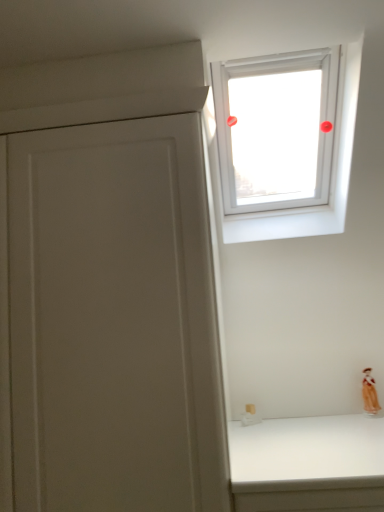
Question: Considering the positions of point (304, 52) and point (372, 385), is point (304, 52) closer or farther from the camera than point (372, 385)?

Choices:
 (A) closer
 (B) farther

Answer: (A)

Question: Which is correct: transparent glass window at upper center is inside matte orange figurine at lower right, or outside of it?

Choices:
 (A) inside
 (B) outside

Answer: (B)

Question: In terms of size, does transparent glass window at upper center appear bigger or smaller than matte orange figurine at lower right?

Choices:
 (A) big
 (B) small

Answer: (A)

Question: Is matte orange figurine at lower right taller or shorter than transparent glass window at upper center?

Choices:
 (A) short
 (B) tall

Answer: (A)

Question: In terms of width, does matte orange figurine at lower right look wider or thinner when compared to transparent glass window at upper center?

Choices:
 (A) thin
 (B) wide

Answer: (A)

Question: Does point (369, 397) appear closer or farther from the camera than point (248, 158)?

Choices:
 (A) farther
 (B) closer

Answer: (B)

Question: From a real-world perspective, relative to transparent glass window at upper center, is matte orange figurine at lower right vertically above or below?

Choices:
 (A) above
 (B) below

Answer: (B)